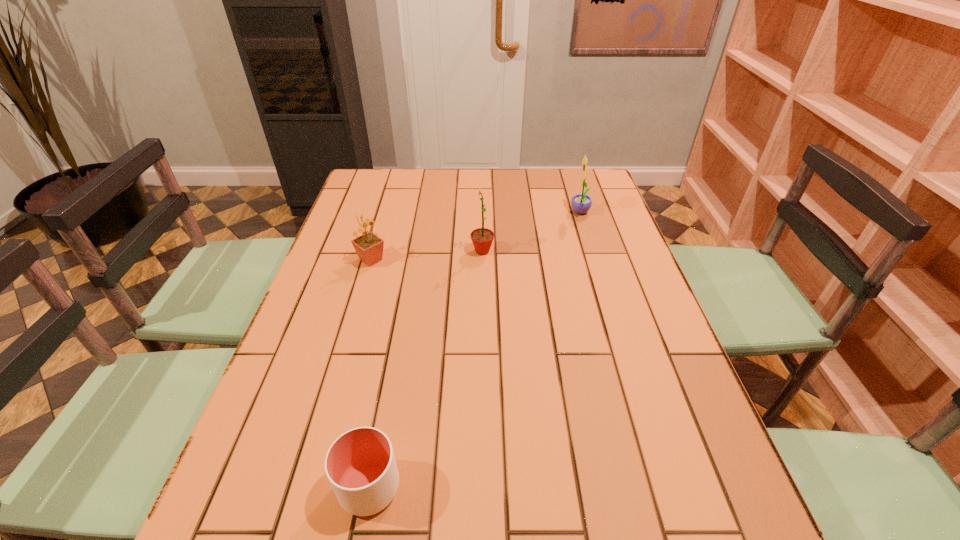
Locate an element on the screen. The height and width of the screenshot is (540, 960). vacant region located 0.220m on the front-facing side of the farthest sunflower is located at coordinates (504, 213).

Where is `vacant region located 0.090m on the front-facing side of the farthest sunflower`? vacant region located 0.090m on the front-facing side of the farthest sunflower is located at coordinates (543, 213).

At what (x,y) coordinates should I click in order to perform the action: click on vacant region located 0.340m on the front-facing side of the farthest sunflower. Please return your answer as a coordinate pair (x, y). Image resolution: width=960 pixels, height=540 pixels. Looking at the image, I should click on (468, 213).

You are a GUI agent. You are given a task and a screenshot of the screen. Output one action in this format:
    pyautogui.click(x=<x>, y=<y>)
    Task: Click on the blank space located at the front of the shortest sunflower with flowers visible
    This screenshot has width=960, height=540.
    Given the screenshot: What is the action you would take?
    pyautogui.click(x=446, y=260)

Find the location of `blank space located 0.300m on the right of the third object from right to left`. blank space located 0.300m on the right of the third object from right to left is located at coordinates (568, 487).

The image size is (960, 540). Identify the location of object that is positioned at the left edge. (369, 247).

Image resolution: width=960 pixels, height=540 pixels. I want to click on object that is at the right edge, so click(x=581, y=203).

The image size is (960, 540). I want to click on vacant space at the far edge of the desktop, so click(430, 194).

In the image, there is a desktop. At what (x,y) coordinates should I click in order to perform the action: click on vacant space at the left edge. Please return your answer as a coordinate pair (x, y). Looking at the image, I should click on (357, 211).

Image resolution: width=960 pixels, height=540 pixels. Identify the location of blank space at the right edge. (615, 262).